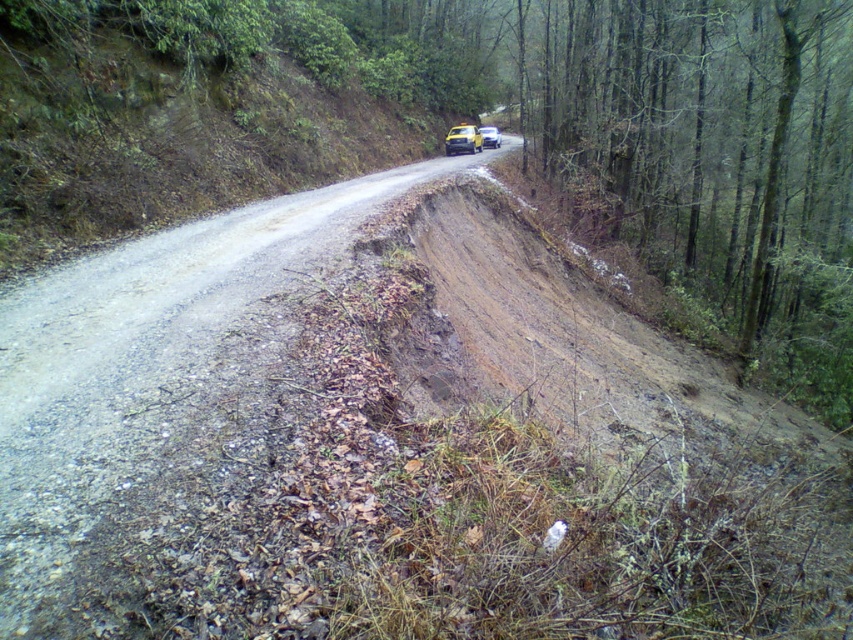
Question: Which point appears farthest from the camera in this image?

Choices:
 (A) (492, 134)
 (B) (473, 141)

Answer: (A)

Question: Which object is positioned farthest from the dirt road at center?

Choices:
 (A) brown/dry leaves at right
 (B) yellow matte jeep at center
 (C) yellow matte car at center

Answer: (C)

Question: Is brown/dry leaves at right below yellow matte jeep at center?

Choices:
 (A) yes
 (B) no

Answer: (B)

Question: Does brown/dry leaves at right appear over yellow matte car at center?

Choices:
 (A) yes
 (B) no

Answer: (B)

Question: Does dirt road at center appear over yellow matte car at center?

Choices:
 (A) yes
 (B) no

Answer: (B)

Question: Among these points, which one is farthest from the camera?

Choices:
 (A) (491, 138)
 (B) (637, 188)
 (C) (245, 269)
 (D) (456, 138)

Answer: (A)